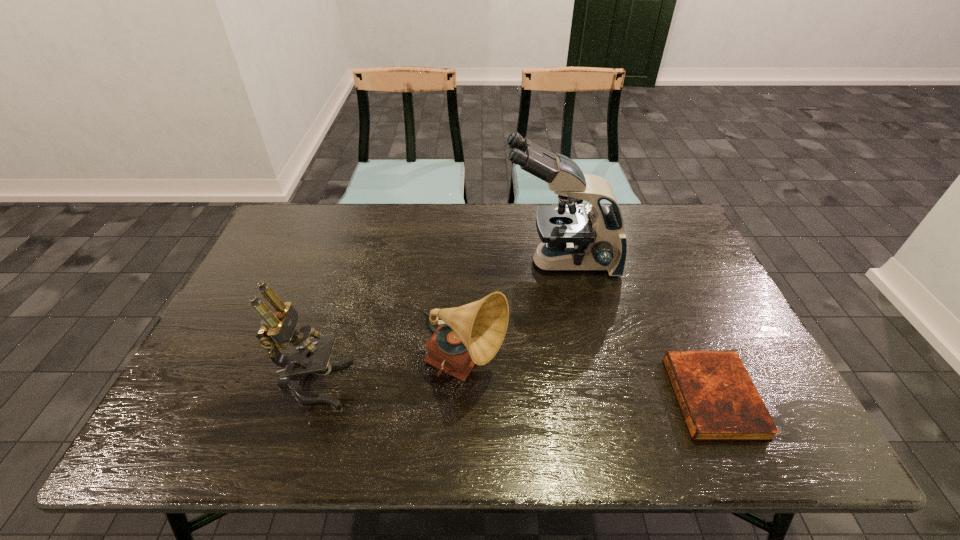
Locate an element on the screen. free space at the near edge of the desktop is located at coordinates (324, 430).

Find the location of a particular element. The width and height of the screenshot is (960, 540). vacant region at the left edge of the desktop is located at coordinates pos(237,355).

At what (x,y) coordinates should I click in order to perform the action: click on free space at the right edge of the desktop. Please return your answer as a coordinate pair (x, y). This screenshot has height=540, width=960. Looking at the image, I should click on (686, 275).

At what (x,y) coordinates should I click in order to perform the action: click on vacant space at the far left corner of the desktop. Please return your answer as a coordinate pair (x, y). Looking at the image, I should click on (301, 219).

In the image, there is a desktop. Identify the location of free region at the near left corner. The width and height of the screenshot is (960, 540). (159, 445).

Locate an element on the screen. The height and width of the screenshot is (540, 960). free space that is in between the farthest object and the rightmost object is located at coordinates (636, 329).

Image resolution: width=960 pixels, height=540 pixels. I want to click on blank region between the phonograph record and the second object from right to left, so click(x=513, y=315).

Identify the location of empty space between the taller microscope and the phonograph record. The image size is (960, 540). (513, 315).

I want to click on vacant point located between the tallest object and the shortest object, so click(636, 329).

Where is `empty space between the leftmost object and the second object from left to right`? empty space between the leftmost object and the second object from left to right is located at coordinates (390, 376).